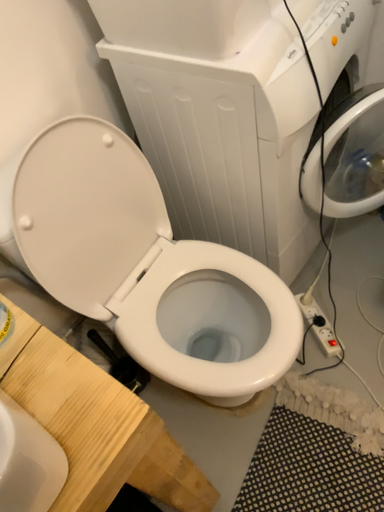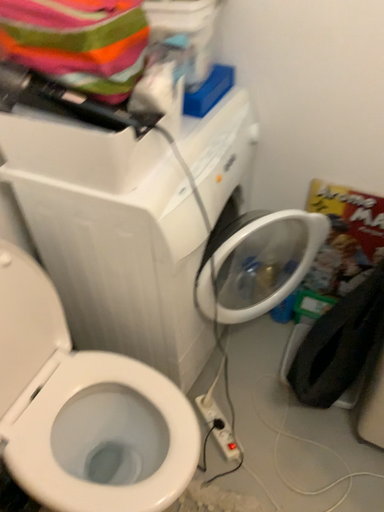
Question: Which way did the camera rotate in the video?

Choices:
 (A) rotated right
 (B) rotated left

Answer: (A)